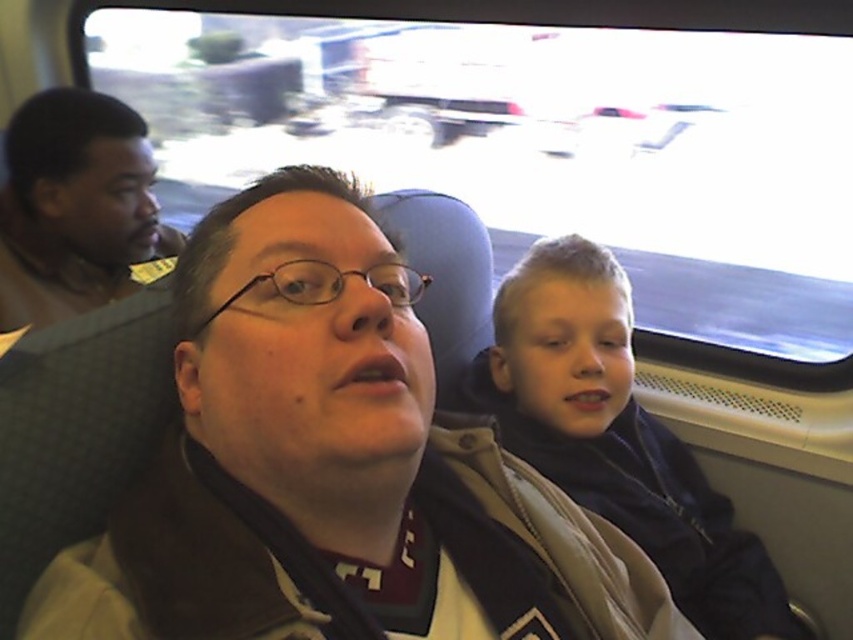
Question: Is dark blue jacket at center bigger than brown leather jacket at left?

Choices:
 (A) yes
 (B) no

Answer: (A)

Question: Is matte brown jacket at center further to camera compared to brown leather jacket at left?

Choices:
 (A) no
 (B) yes

Answer: (A)

Question: Which object is positioned closest to the dark blue jacket at center?

Choices:
 (A) brown leather jacket at left
 (B) matte brown jacket at center

Answer: (B)

Question: Is matte brown jacket at center smaller than brown leather jacket at left?

Choices:
 (A) no
 (B) yes

Answer: (A)

Question: Which of the following is the closest to the observer?

Choices:
 (A) click(x=180, y=582)
 (B) click(x=61, y=198)

Answer: (A)

Question: Among these objects, which one is farthest from the camera?

Choices:
 (A) brown leather jacket at left
 (B) matte brown jacket at center

Answer: (A)